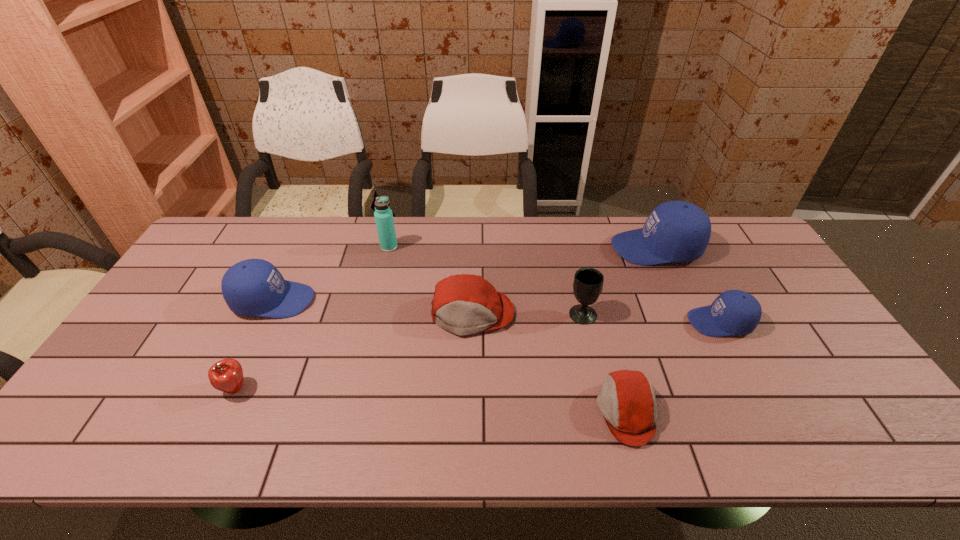
Identify the location of apple. The height and width of the screenshot is (540, 960). (226, 375).

At what (x,y) coordinates should I click in order to perform the action: click on the shortest object. Please return your answer as a coordinate pair (x, y). Image resolution: width=960 pixels, height=540 pixels. Looking at the image, I should click on (627, 402).

Locate an element on the screen. The width and height of the screenshot is (960, 540). the nearer red cap is located at coordinates (627, 402).

You are a GUI agent. You are given a task and a screenshot of the screen. Output one action in this format:
    pyautogui.click(x=<x>, y=<y>)
    Task: Click on the vacant space situated on the back of the thermos bottle
    The height and width of the screenshot is (540, 960).
    Given the screenshot: What is the action you would take?
    pyautogui.click(x=395, y=222)

Identify the location of free region located 0.360m on the front-facing side of the farthest cap. (504, 248).

Where is `vacant space situated 0.230m on the front-facing side of the farthest cap`? This screenshot has width=960, height=540. vacant space situated 0.230m on the front-facing side of the farthest cap is located at coordinates (542, 248).

Find the location of a particular element. vacant point located 0.080m on the front-facing side of the farthest cap is located at coordinates (588, 248).

This screenshot has height=540, width=960. Find the location of `vacant area located on the back of the chalice`. vacant area located on the back of the chalice is located at coordinates (576, 287).

Locate an element on the screen. The height and width of the screenshot is (540, 960). blank area located 0.360m on the front-facing side of the second biggest blue cap is located at coordinates (436, 300).

The width and height of the screenshot is (960, 540). Find the location of `free space located 0.150m on the front-facing side of the bigger red cap`. free space located 0.150m on the front-facing side of the bigger red cap is located at coordinates [x=471, y=386].